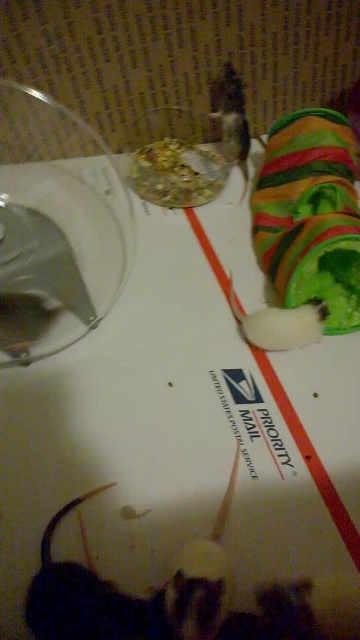
Question: Which of the following is the closest to the observer?

Choices:
 (A) shiny metallic food at center
 (B) white paper at center

Answer: (B)

Question: Does shiny metallic food at center have a smaller size compared to white paper at center?

Choices:
 (A) no
 (B) yes

Answer: (B)

Question: Is shiny metallic food at center positioned at the back of white paper at center?

Choices:
 (A) yes
 (B) no

Answer: (A)

Question: Which object appears closest to the camera in this image?

Choices:
 (A) shiny metallic food at center
 (B) white paper at center

Answer: (B)

Question: Can you confirm if shiny metallic food at center is wider than white paper at center?

Choices:
 (A) yes
 (B) no

Answer: (B)